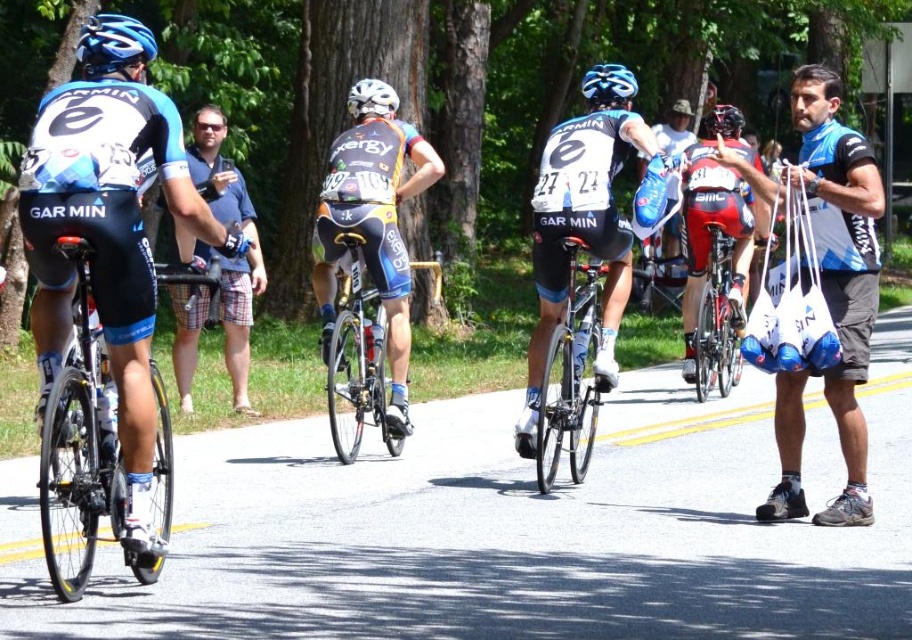
In the scene shown: Who is more distant from viewer, (78, 422) or (736, 369)?

The point (736, 369) is behind.

Locate an element on the screen. This screenshot has width=912, height=640. shiny black frame at left is located at coordinates (81, 449).

Who is shorter, blue jersey at right or shiny red bicycle at center?

With less height is shiny red bicycle at center.

Does blue jersey at right lie behind shiny red bicycle at center?

No, blue jersey at right is closer to the viewer.

This screenshot has height=640, width=912. Find the location of `blue jersey at right`. blue jersey at right is located at coordinates (828, 291).

Does blue plaid shorts at left appear on the right side of gold metallic bicycle at center?

Incorrect, blue plaid shorts at left is not on the right side of gold metallic bicycle at center.

Which is more to the left, blue plaid shorts at left or gold metallic bicycle at center?

Positioned to the left is blue plaid shorts at left.

Between point (237, 381) and point (379, 372), which one is positioned behind?

Positioned behind is point (237, 381).

Find the location of a particular element. This screenshot has height=640, width=912. blue plaid shorts at left is located at coordinates (225, 256).